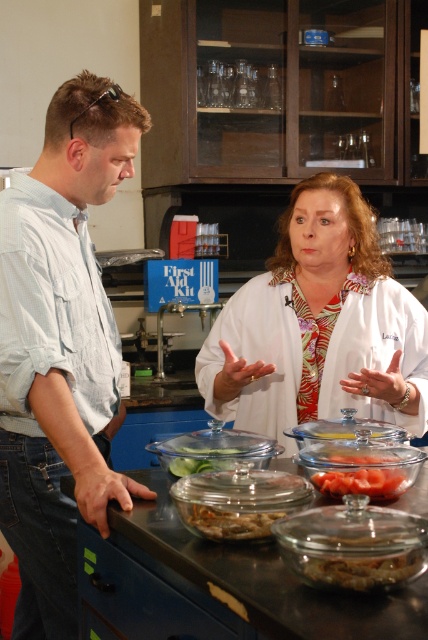
You are standing in the laboratory and see the man in light blue shirt and jeans and the point at coordinates (x=318, y=324). What object is located at that point?

The point at coordinates (x=318, y=324) indicates the white glossy lab coat at center.

You are standing in the laboratory and want to take a photo of both point (x=79, y=166) and point (x=187, y=636). Which point should you focus on first to ensure both are in focus?

You should focus on point (x=79, y=166) first because it is closer to the camera than point (x=187, y=636). By focusing on the closer point, the depth of field may also cover the farther point, ensuring both are in focus.

You are standing in the laboratory and need to place a small tool exactly at the coordinates where the white glossy lab coat at center is located. Can you confirm the coordinates for placing the tool?

The white glossy lab coat at center is located at coordinates point (318, 324), so you can place the tool there.